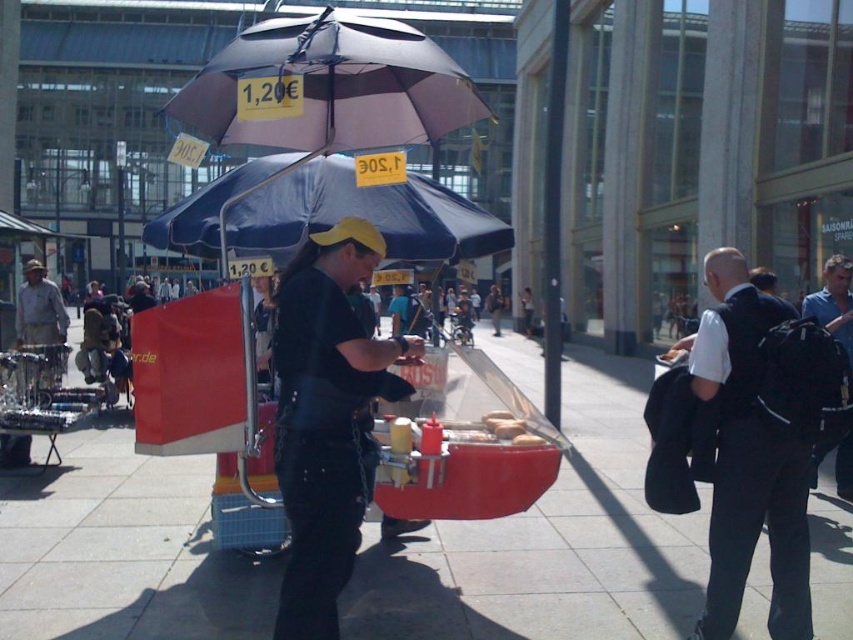
Question: Is black fabric backpack at right to the left of blue fabric umbrella at center from the viewer's perspective?

Choices:
 (A) no
 (B) yes

Answer: (A)

Question: Which object is farther from the camera taking this photo?

Choices:
 (A) blue fabric umbrella at center
 (B) matte black umbrella at upper center

Answer: (A)

Question: Which of the following is the farthest from the observer?

Choices:
 (A) (721, 484)
 (B) (316, 385)
 (C) (318, 72)

Answer: (C)

Question: Which object is the farthest from the black leather jacket at center?

Choices:
 (A) smooth red cart at center
 (B) black fabric backpack at right
 (C) matte black umbrella at upper center

Answer: (A)

Question: Is smooth red cart at center further to camera compared to black leather jacket at center?

Choices:
 (A) yes
 (B) no

Answer: (A)

Question: Does black leather jacket at center lie in front of black fabric backpack at right?

Choices:
 (A) no
 (B) yes

Answer: (B)